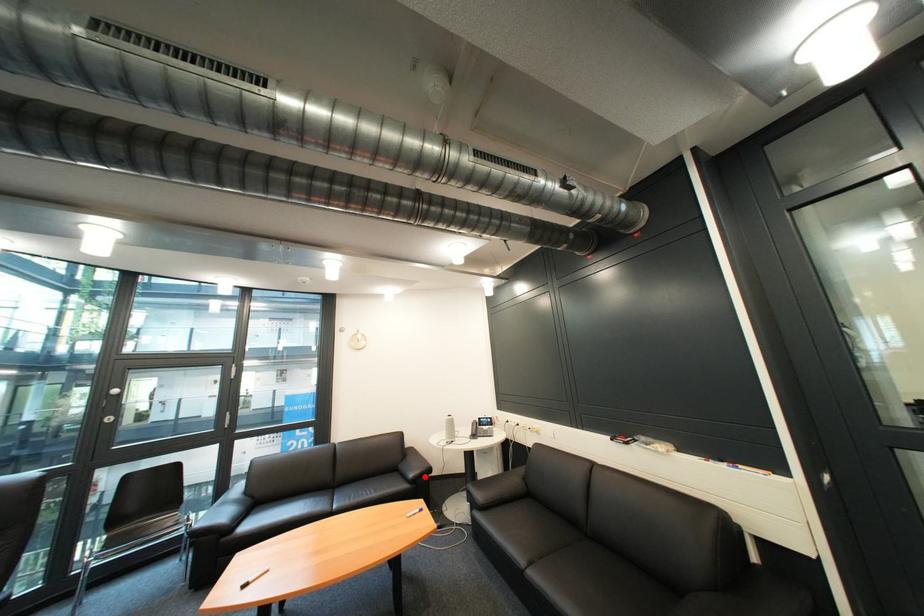
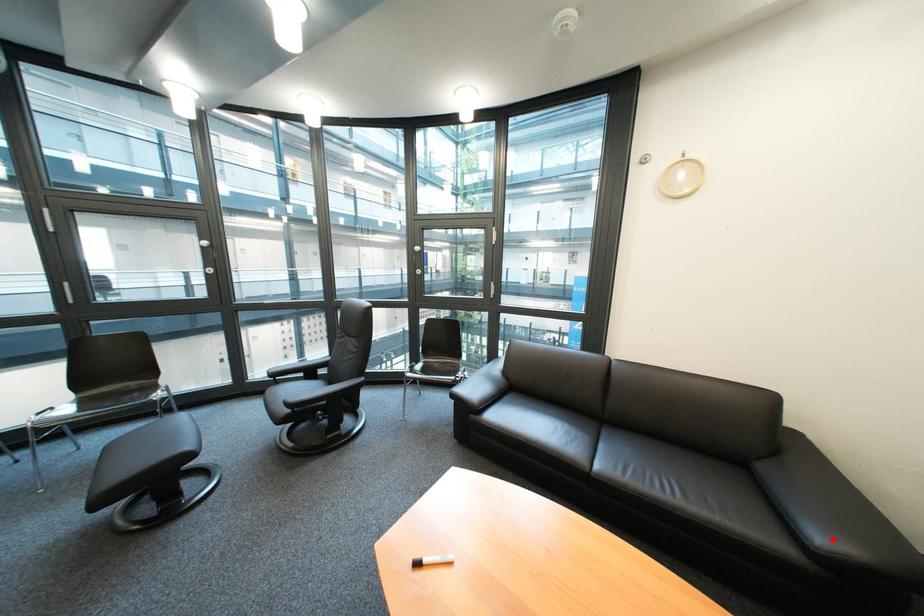
I am providing you with two images of the same scene from different viewpoints. A red point is marked on the first image and another point is marked on the second image. Is the red point in image1 aligned with the point shown in image2?

Yes